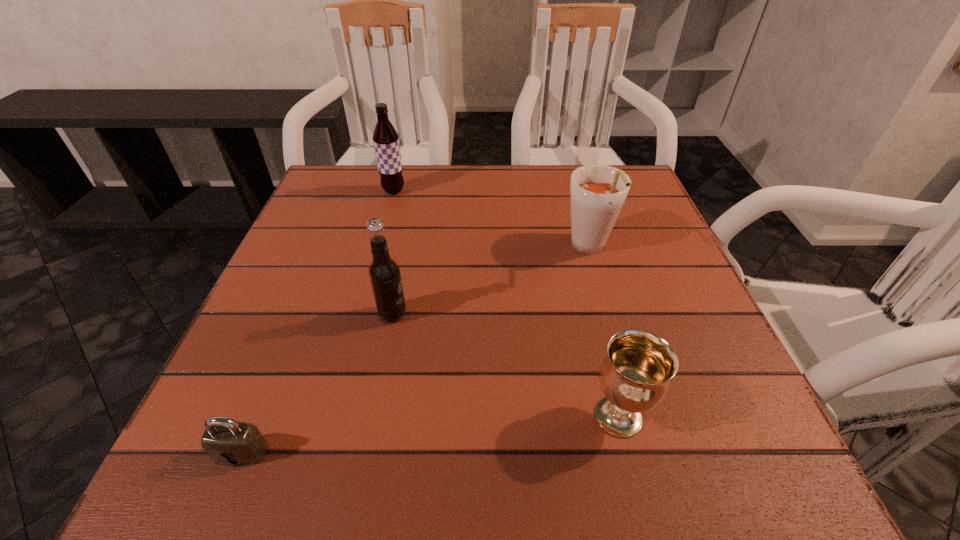
What are the coordinates of `the leftmost root beer` in the screenshot? It's located at (386, 139).

You are a GUI agent. You are given a task and a screenshot of the screen. Output one action in this format:
    pyautogui.click(x=<x>, y=<y>)
    Task: Click on the farthest object
    This screenshot has width=960, height=540.
    Given the screenshot: What is the action you would take?
    pyautogui.click(x=386, y=139)

Locate an element on the screen. This screenshot has width=960, height=540. the second nearest root beer is located at coordinates [x=597, y=192].

Where is `the fourth nearest object`? the fourth nearest object is located at coordinates (597, 192).

The width and height of the screenshot is (960, 540). Identify the location of the nearest root beer. (384, 273).

Identify the location of the third nearest object. This screenshot has width=960, height=540. (384, 273).

Where is `the second shortest object`? the second shortest object is located at coordinates (635, 375).

Locate an element on the screen. the leftmost object is located at coordinates (228, 442).

You are a GUI agent. You are given a task and a screenshot of the screen. Output one action in this format:
    pyautogui.click(x=<x>, y=<y>)
    Task: Click on the padlock
    The height and width of the screenshot is (540, 960).
    Given the screenshot: What is the action you would take?
    pyautogui.click(x=228, y=442)

Where is `vacant space situated on the front of the farthest object`? This screenshot has width=960, height=540. vacant space situated on the front of the farthest object is located at coordinates (x=383, y=232).